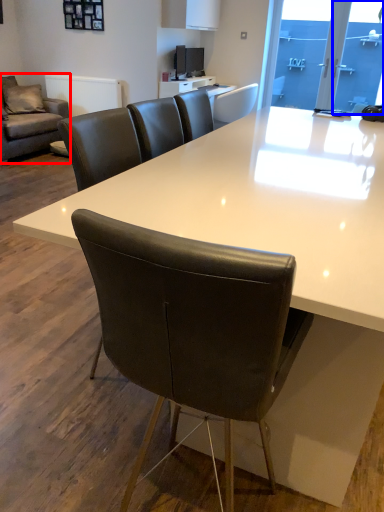
Question: Which point is further to the camera, studio couch (highlighted by a red box) or glass door (highlighted by a blue box)?

Choices:
 (A) studio couch
 (B) glass door

Answer: (B)